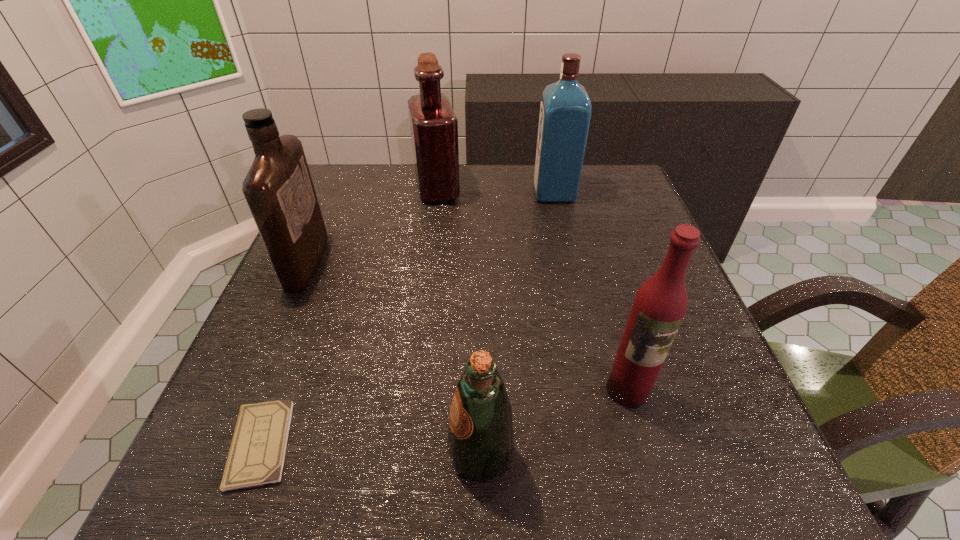
Where is `unoccupied position between the checkbook and the fourth object from left to right`? The width and height of the screenshot is (960, 540). unoccupied position between the checkbook and the fourth object from left to right is located at coordinates (371, 449).

At what (x,y) coordinates should I click in order to perform the action: click on object that ranks as the second closest to the fifth tallest object. Please return your answer as a coordinate pair (x, y). Image resolution: width=960 pixels, height=540 pixels. Looking at the image, I should click on (257, 453).

Identify which object is located as the nearest to the shortest object. Please provide its 2D coordinates. Your answer should be formatted as a tuple, i.e. [(x, y)], where the tuple contains the x and y coordinates of a point satisfying the conditions above.

[(480, 439)]

Choose which liquor is the nearest neighbor to the checkbook. Please provide its 2D coordinates. Your answer should be formatted as a tuple, i.e. [(x, y)], where the tuple contains the x and y coordinates of a point satisfying the conditions above.

[(278, 188)]

Identify the location of liquor that is the fourth nearest to the fourth object from left to right. (x=565, y=108).

Image resolution: width=960 pixels, height=540 pixels. Find the location of `vacant point that satisfies the following two spatial constraints: 1. on the label side of the second nearest liquor; 2. on the back side of the checkbook`. vacant point that satisfies the following two spatial constraints: 1. on the label side of the second nearest liquor; 2. on the back side of the checkbook is located at coordinates (227, 444).

Where is `free region that satisfies the following two spatial constraints: 1. on the label side of the checkbook; 2. on the left side of the third farthest liquor`? This screenshot has height=540, width=960. free region that satisfies the following two spatial constraints: 1. on the label side of the checkbook; 2. on the left side of the third farthest liquor is located at coordinates (227, 444).

Locate an element on the screen. free point that satisfies the following two spatial constraints: 1. on the back side of the checkbook; 2. on the label side of the leftmost liquor is located at coordinates (330, 261).